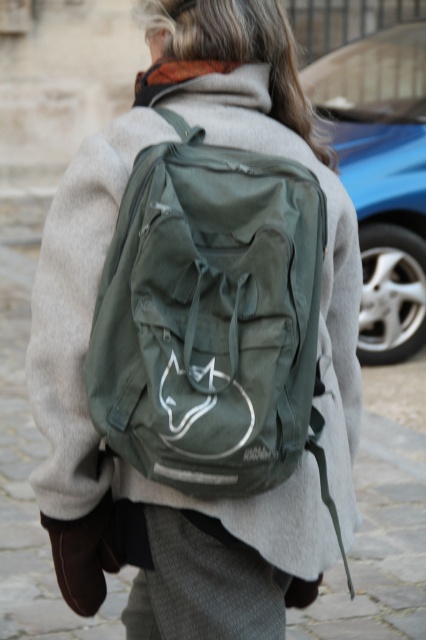
Who is lower down, olive green fabric backpack at center or blue metallic car at upper right?

olive green fabric backpack at center is below.

Between olive green fabric backpack at center and blue metallic car at upper right, which one appears on the left side from the viewer's perspective?

Positioned to the left is olive green fabric backpack at center.

Identify the location of olive green fabric backpack at center. (210, 317).